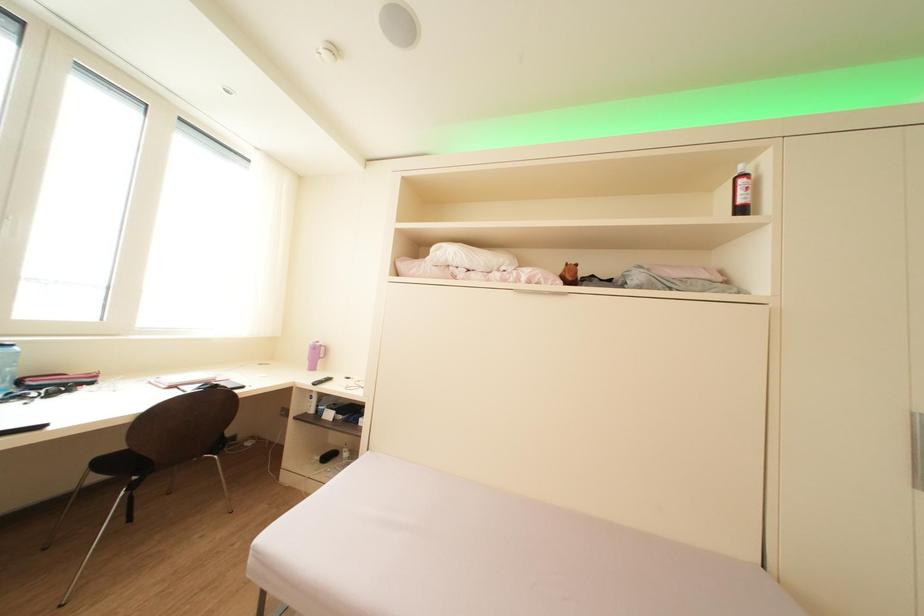
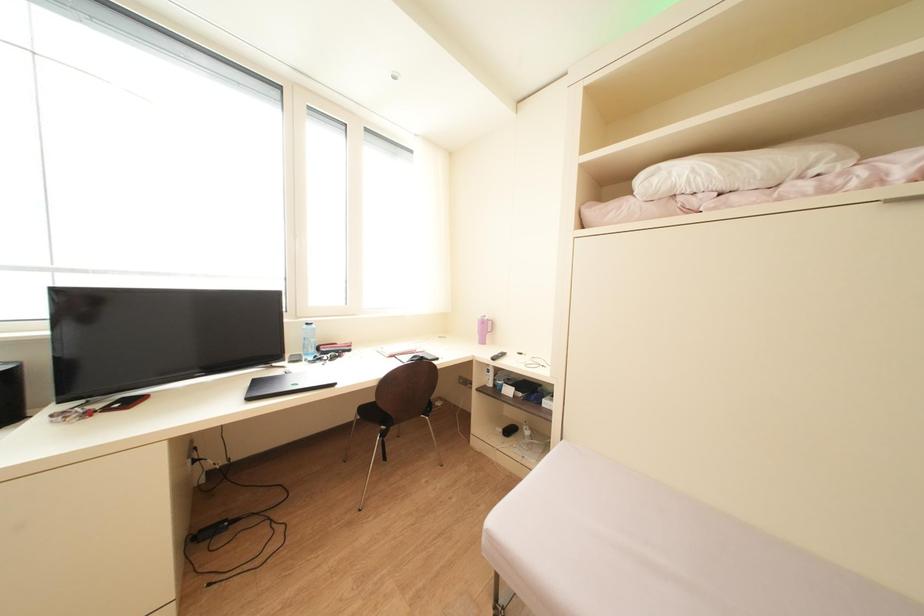
Question: The images are taken continuously from a first-person perspective. In which direction is your viewpoint rotating?

Choices:
 (A) Left
 (B) Right
 (C) Up
 (D) Down

Answer: (A)